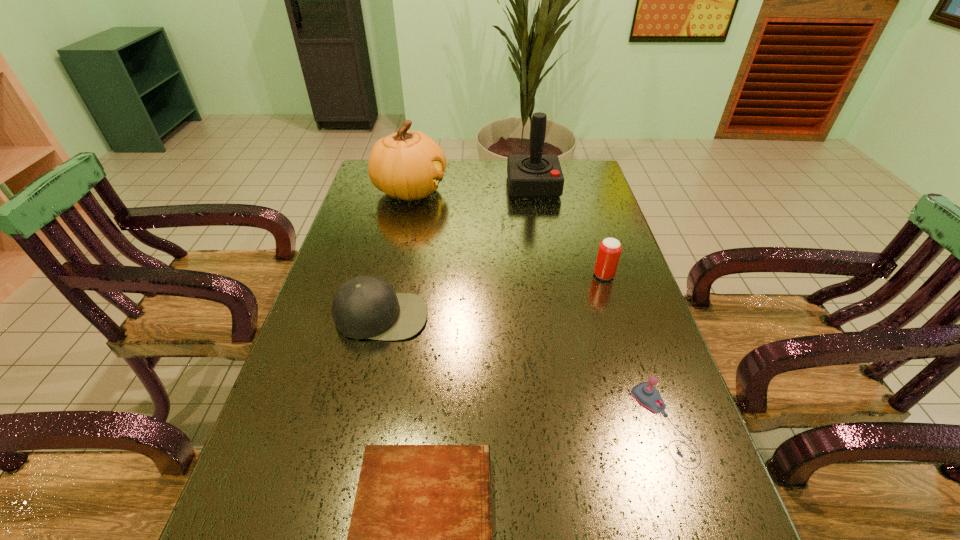
This screenshot has height=540, width=960. I want to click on vacant space at the left edge of the desktop, so click(x=368, y=198).

At what (x,y) coordinates should I click in order to perform the action: click on vacant space at the right edge of the desktop. Please return your answer as a coordinate pair (x, y). The image size is (960, 540). Looking at the image, I should click on (703, 489).

You are a GUI agent. You are given a task and a screenshot of the screen. Output one action in this format:
    pyautogui.click(x=<x>, y=<y>)
    Task: Click on the vacant space in between the taller joystick and the fourth farthest object
    
    Given the screenshot: What is the action you would take?
    pyautogui.click(x=457, y=251)

This screenshot has width=960, height=540. Identify the location of vacant area that lies between the left joystick and the cap. (457, 251).

What are the coordinates of `free space between the pumpkin and the taller joystick` in the screenshot? It's located at (471, 188).

In order to click on free space between the third nearest object and the taller joystick in this screenshot , I will do `click(457, 251)`.

At what (x,y) coordinates should I click in order to perform the action: click on blank region between the second shortest object and the third nearest object. Please return your answer as a coordinate pair (x, y). Looking at the image, I should click on (522, 370).

In order to click on vacant point located between the pumpkin and the fourth object from left to right in this screenshot , I will do `click(471, 188)`.

Identify the location of empty location between the third farthest object and the shorter joystick. The width and height of the screenshot is (960, 540). (634, 349).

Locate which object is the third closest to the cap. Please provide its 2D coordinates. Your answer should be formatted as a tuple, i.e. [(x, y)], where the tuple contains the x and y coordinates of a point satisfying the conditions above.

[(609, 251)]